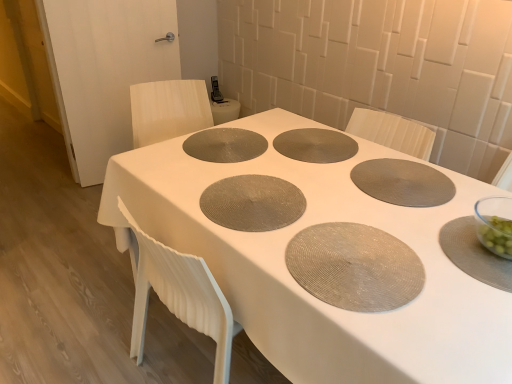
The width and height of the screenshot is (512, 384). In order to click on vacant space behind matte gray placemat at center, positioned as the 3th pizza pan in right-to-left order in this screenshot , I will do `click(250, 153)`.